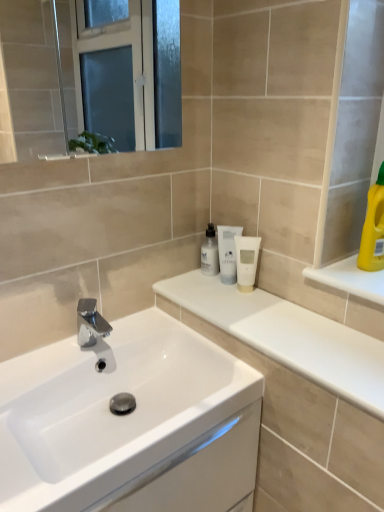
In order to click on free location to the left of white matte tube at center, positioned as the third mouthwash in left-to-right order in this screenshot , I will do `click(201, 293)`.